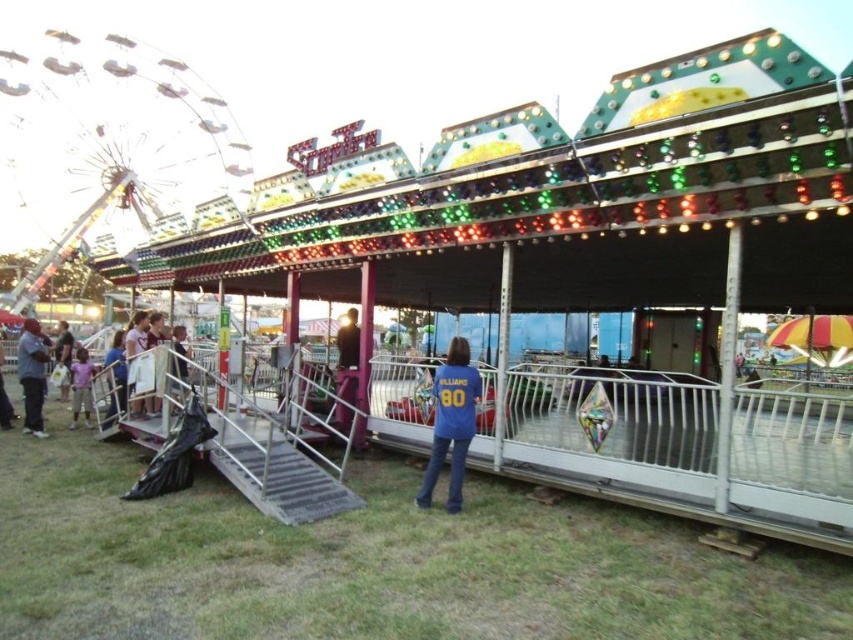
This screenshot has width=853, height=640. What do you see at coordinates (451, 422) in the screenshot? I see `blue jersey at center` at bounding box center [451, 422].

Between blue jersey at center and blue denim jacket at center, which one is positioned higher?

blue denim jacket at center is higher up.

Find the location of `blue jersey at center`. blue jersey at center is located at coordinates (451, 422).

The height and width of the screenshot is (640, 853). Find the location of `blue jersey at center`. blue jersey at center is located at coordinates (451, 422).

Is blue jersey at center further to camera compared to light purple shirt at lower left?

No.

This screenshot has width=853, height=640. In order to click on blue jersey at center in this screenshot , I will do `click(451, 422)`.

Who is more distant from viewer, [44,346] or [80,355]?

The point [80,355] is behind.

Which of these two, dark blue jeans at left or light purple shirt at lower left, stands shorter?

With less height is light purple shirt at lower left.

Who is more distant from viewer, [33,355] or [73,362]?

The point [73,362] is behind.

This screenshot has height=640, width=853. I want to click on dark blue jeans at left, so click(32, 376).